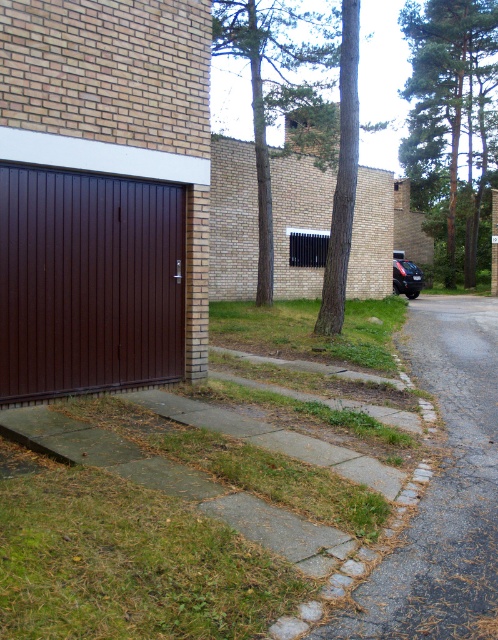
You are standing in front of the garage and want to know which tree is higher. Can you tell me which one is taller between the green leafy tree at upper center and the green textured tree at center?

The green leafy tree at upper center is taller than the green textured tree at center.